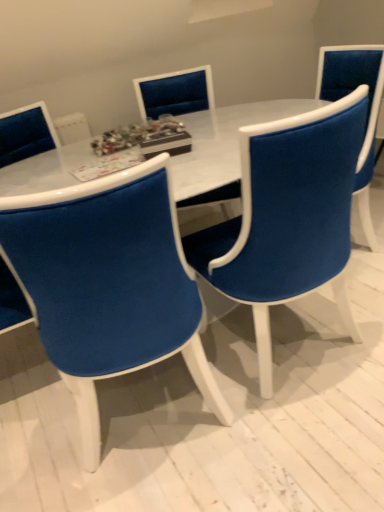
Question: Considering the relative positions of velvet blue chair at center, the third chair positioned from the back, and velvet blue chair at center, placed as the 2th chair when sorted from back to front, in the image provided, is velvet blue chair at center, the third chair positioned from the back, to the left or to the right of velvet blue chair at center, placed as the 2th chair when sorted from back to front,?

Choices:
 (A) left
 (B) right

Answer: (A)

Question: Based on their sizes in the image, would you say velvet blue chair at center, the third chair positioned from the back, is bigger or smaller than velvet blue chair at center, the 2th chair positioned from the front?

Choices:
 (A) big
 (B) small

Answer: (B)

Question: Estimate the real-world distances between objects in this image. Which object is farther from the velvet blue chair at center, arranged as the first chair when viewed from the front?

Choices:
 (A) velvet blue chair at center, the 2th chair positioned from the front
 (B) velvet blue chair at center, arranged as the third chair when viewed from the front
 (C) white marble table at center

Answer: (B)

Question: Based on their relative distances, which object is farther from the velvet blue chair at center, arranged as the first chair when viewed from the front?

Choices:
 (A) velvet blue chair at center, placed as the 2th chair when sorted from back to front
 (B) velvet blue chair at center, the 1th chair in the back-to-front sequence
 (C) white marble table at center

Answer: (B)